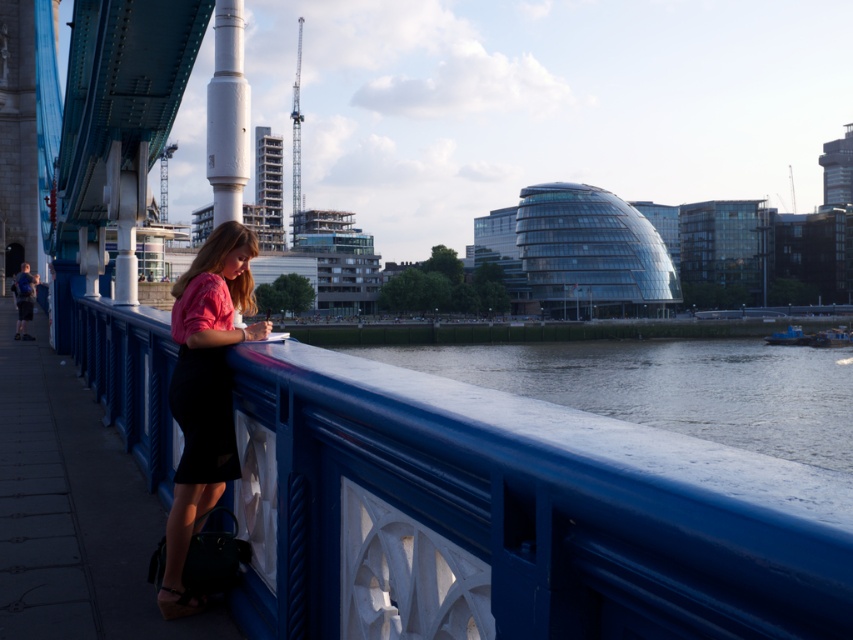
Between blue smooth water at lower center and matte pink blouse at center, which one has less height?

matte pink blouse at center is shorter.

Can you confirm if blue smooth water at lower center is positioned above matte pink blouse at center?

No.

I want to click on blue smooth water at lower center, so click(672, 387).

Can you confirm if blue painted wood at center is positioned below blue smooth water at lower center?

No.

Who is higher up, blue painted wood at center or blue smooth water at lower center?

blue painted wood at center

Describe the element at coordinates (512, 515) in the screenshot. I see `blue painted wood at center` at that location.

Locate an element on the screen. This screenshot has width=853, height=640. blue painted wood at center is located at coordinates (512, 515).

Is blue painted wood at center positioned behind matte pink blouse at center?

No, blue painted wood at center is closer to the viewer.

I want to click on blue painted wood at center, so click(512, 515).

Who is more distant from viewer, (419, 611) or (207, 365)?

Positioned behind is point (207, 365).

The height and width of the screenshot is (640, 853). In order to click on blue painted wood at center in this screenshot , I will do `click(512, 515)`.